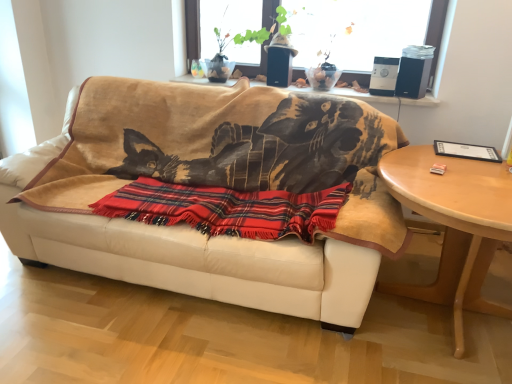
Question: Is light wood/finished table at right in front of or behind transparent glass window at upper center in the image?

Choices:
 (A) behind
 (B) front

Answer: (B)

Question: From a real-world perspective, relative to transparent glass window at upper center, is light wood/finished table at right vertically above or below?

Choices:
 (A) above
 (B) below

Answer: (B)

Question: Which of these objects is positioned farthest from the transparent glass window at upper center?

Choices:
 (A) light wood/finished table at right
 (B) plaid fabric blanket at center
 (C) white leather couch at center

Answer: (A)

Question: Based on their relative distances, which object is farther from the plaid fabric blanket at center?

Choices:
 (A) white leather couch at center
 (B) transparent glass window at upper center
 (C) light wood/finished table at right

Answer: (B)